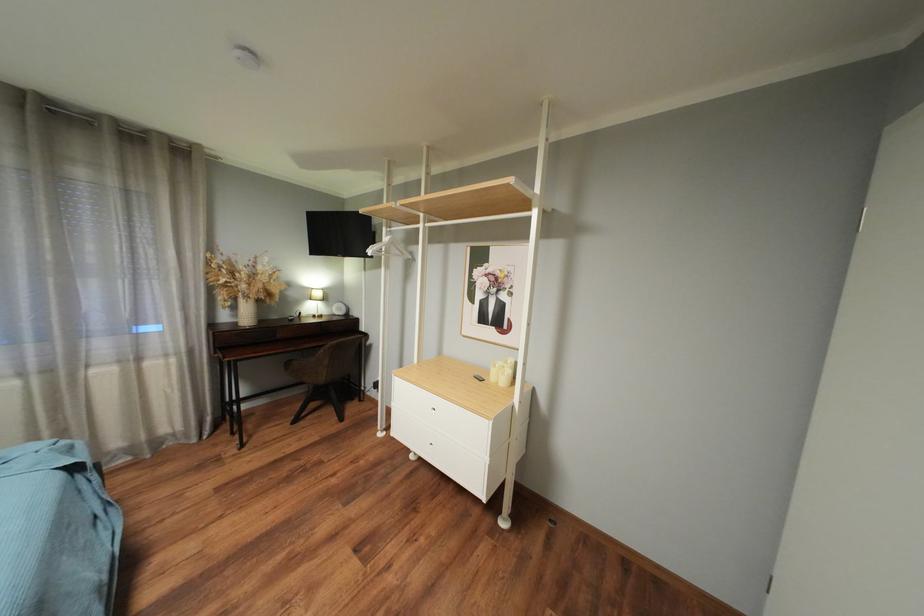
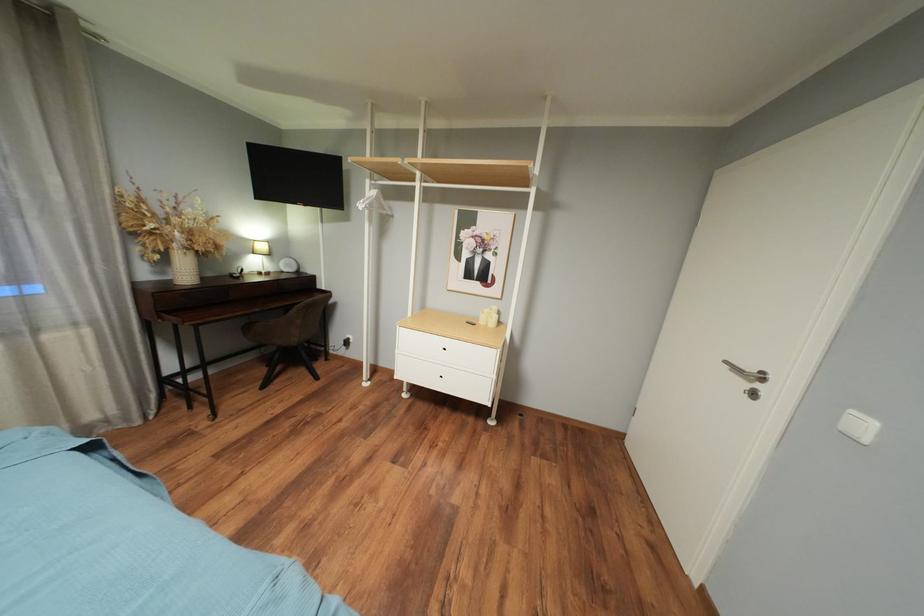
Question: Which direction would the cameraman need to move to produce the second image? Reply with the corresponding letter.

Choices:
 (A) Left
 (B) Right
 (C) Forward
 (D) Backward

Answer: (A)